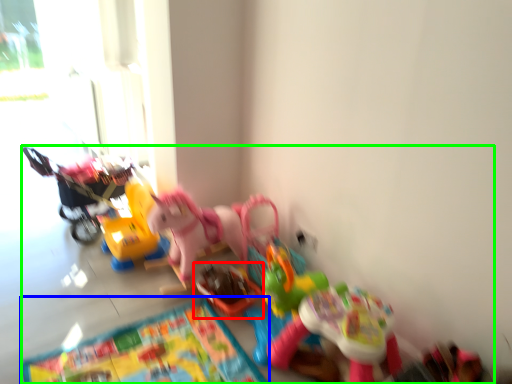
Question: Which object is positioned farthest from toy (highlighted by a red box)? Select from mat (highlighted by a blue box) and toy (highlighted by a green box).

Choices:
 (A) mat
 (B) toy

Answer: (B)